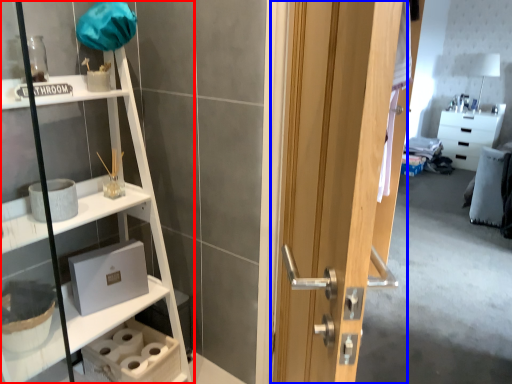
Question: Which point is further to the camera, shelf (highlighted by a red box) or door (highlighted by a blue box)?

Choices:
 (A) shelf
 (B) door

Answer: (A)